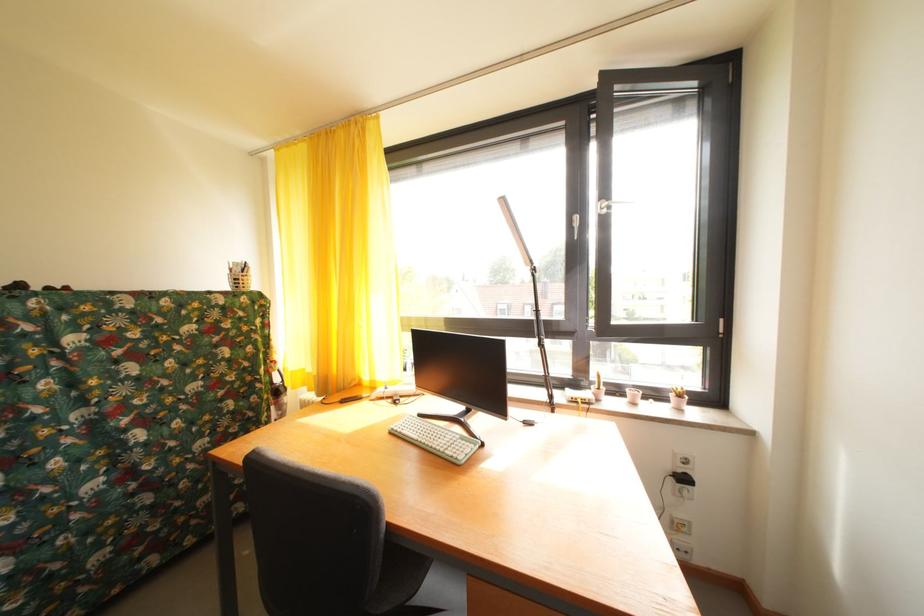
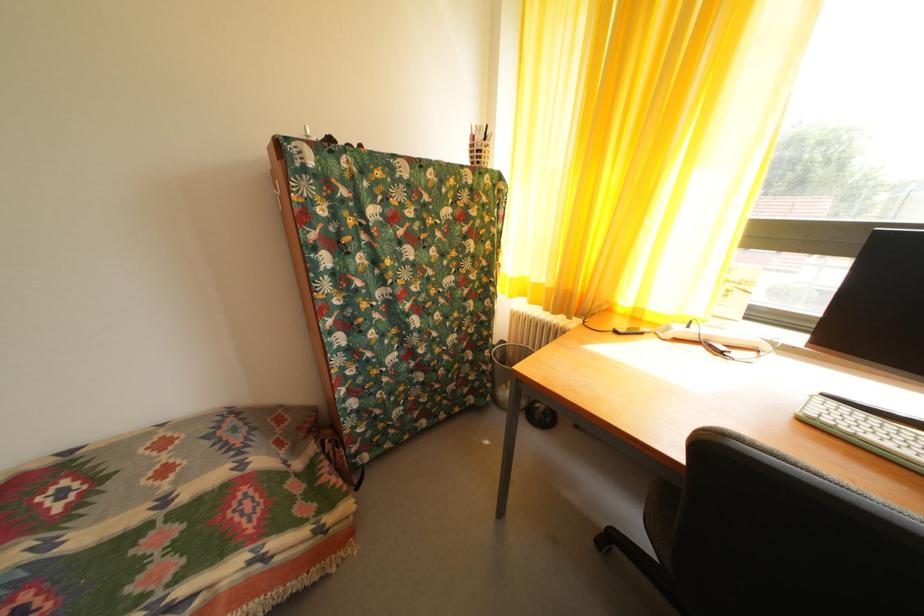
First-person continuous shooting, in which direction is the camera rotating?

The camera's rotation is toward left-down.